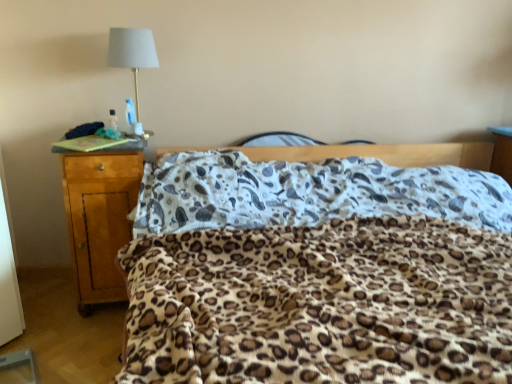
Question: From the image's perspective, is light brown wood nightstand at left located above white fabric lampshade at upper left?

Choices:
 (A) no
 (B) yes

Answer: (A)

Question: Is light brown wood nightstand at left touching white fabric lampshade at upper left?

Choices:
 (A) no
 (B) yes

Answer: (A)

Question: From a real-world perspective, is light brown wood nightstand at left physically above white fabric lampshade at upper left?

Choices:
 (A) no
 (B) yes

Answer: (A)

Question: Considering the relative sizes of light brown wood nightstand at left and white fabric lampshade at upper left in the image provided, is light brown wood nightstand at left smaller than white fabric lampshade at upper left?

Choices:
 (A) no
 (B) yes

Answer: (A)

Question: Is light brown wood nightstand at left bigger than white fabric lampshade at upper left?

Choices:
 (A) yes
 (B) no

Answer: (A)

Question: Looking at the image, does light brown wood nightstand at left seem bigger or smaller compared to leopard print blanket at center?

Choices:
 (A) big
 (B) small

Answer: (B)

Question: Is light brown wood nightstand at left wider or thinner than leopard print blanket at center?

Choices:
 (A) thin
 (B) wide

Answer: (A)

Question: In the image, is light brown wood nightstand at left on the left side or the right side of leopard print blanket at center?

Choices:
 (A) right
 (B) left

Answer: (B)

Question: Is light brown wood nightstand at left taller or shorter than leopard print blanket at center?

Choices:
 (A) tall
 (B) short

Answer: (A)

Question: In terms of size, does leopard print blanket at center appear bigger or smaller than light brown wood nightstand at left?

Choices:
 (A) big
 (B) small

Answer: (A)

Question: Is point (226, 382) positioned closer to the camera than point (100, 193)?

Choices:
 (A) closer
 (B) farther

Answer: (A)

Question: In the image, is leopard print blanket at center positioned in front of or behind light brown wood nightstand at left?

Choices:
 (A) behind
 (B) front

Answer: (B)

Question: Considering the positions of leopard print blanket at center and light brown wood nightstand at left in the image, is leopard print blanket at center wider or thinner than light brown wood nightstand at left?

Choices:
 (A) wide
 (B) thin

Answer: (A)

Question: From the image's perspective, is leopard print blanket at center located above or below white fabric lampshade at upper left?

Choices:
 (A) below
 (B) above

Answer: (A)

Question: Is leopard print blanket at center wider or thinner than white fabric lampshade at upper left?

Choices:
 (A) thin
 (B) wide

Answer: (B)